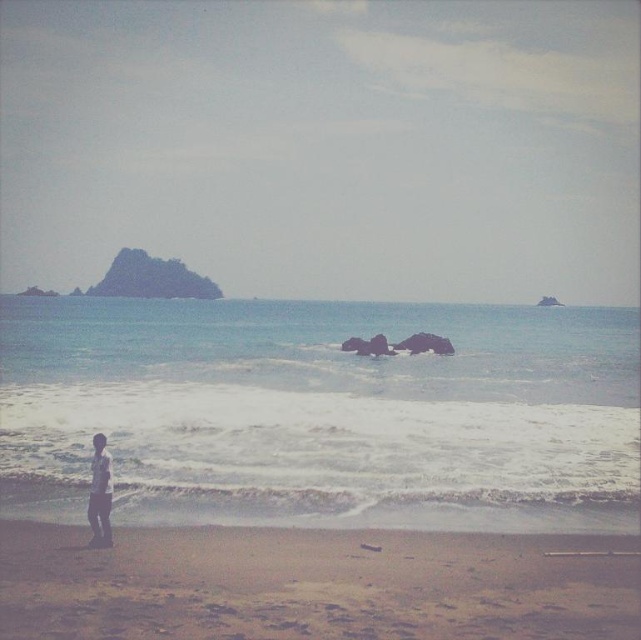
Question: Which point is closer to the camera?

Choices:
 (A) (419, 401)
 (B) (104, 496)

Answer: (B)

Question: Which object is positioned farthest from the clear blue water at lower center?

Choices:
 (A) brown sandy beach at lower center
 (B) light blue denim jeans at lower left

Answer: (B)

Question: Which point appears closest to the camera in this image?

Choices:
 (A) (251, 444)
 (B) (138, 611)

Answer: (B)

Question: Does brown sandy beach at lower center have a lesser width compared to light blue denim jeans at lower left?

Choices:
 (A) no
 (B) yes

Answer: (A)

Question: Is clear blue water at lower center positioned behind brown sandy beach at lower center?

Choices:
 (A) no
 (B) yes

Answer: (B)

Question: Can you confirm if clear blue water at lower center is bigger than brown sandy beach at lower center?

Choices:
 (A) no
 (B) yes

Answer: (B)